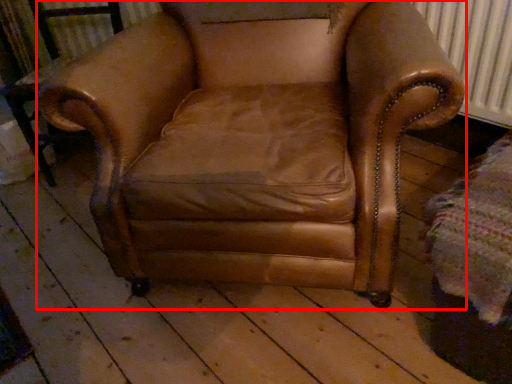
Question: From the image's perspective, where is chair (annotated by the red box) located relative to side table?

Choices:
 (A) above
 (B) below

Answer: (A)